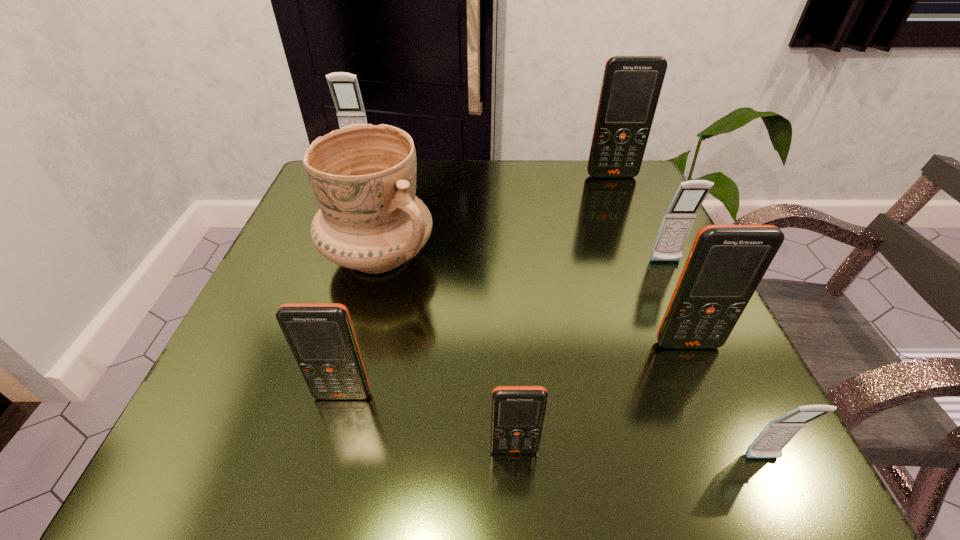
Find the location of `the fourth closest cellular telephone relative to the leftmost cellular telephone`. the fourth closest cellular telephone relative to the leftmost cellular telephone is located at coordinates (726, 263).

Identify which cellular telephone is the nearest to the biggest orange cellular telephone. Please provide its 2D coordinates. Your answer should be formatted as a tuple, i.e. [(x, y)], where the tuple contains the x and y coordinates of a point satisfying the conditions above.

[(678, 219)]

I want to click on orange cellular telephone that stands as the third closest to the farthest orange cellular telephone, so click(x=321, y=337).

Identify which orange cellular telephone is located as the nearest to the nearest gray cellular telephone. Please provide its 2D coordinates. Your answer should be formatted as a tuple, i.e. [(x, y)], where the tuple contains the x and y coordinates of a point satisfying the conditions above.

[(726, 263)]

The height and width of the screenshot is (540, 960). What are the coordinates of `the second closest gray cellular telephone relative to the fourth nearest object` in the screenshot? It's located at (678, 219).

The image size is (960, 540). Find the location of `gray cellular telephone that is the second closest to the tallest object`. gray cellular telephone that is the second closest to the tallest object is located at coordinates [344, 87].